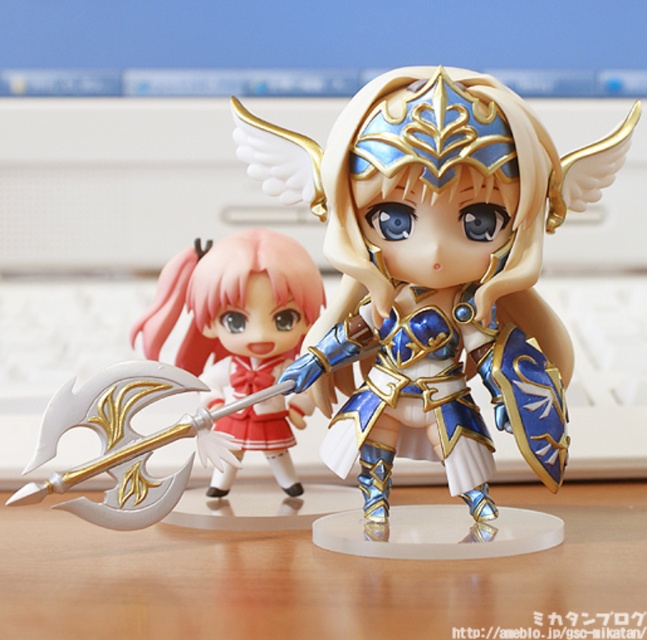
Question: Which point is closer to the camera taking this photo?

Choices:
 (A) (465, 381)
 (B) (393, 605)
 (C) (215, 378)

Answer: (B)

Question: Is blue metallic armor at center further to the viewer compared to matte gold axe at center?

Choices:
 (A) yes
 (B) no

Answer: (B)

Question: Which of these objects is positioned closest to the wooden table at center?

Choices:
 (A) matte gold axe at center
 (B) blue metallic armor at center

Answer: (B)

Question: Does blue metallic armor at center appear on the right side of wooden table at center?

Choices:
 (A) no
 (B) yes

Answer: (B)

Question: Which point is farther to the camera?

Choices:
 (A) (342, 602)
 (B) (302, 266)
 (C) (384, 440)

Answer: (B)

Question: Observing the image, what is the correct spatial positioning of blue metallic armor at center in reference to matte gold axe at center?

Choices:
 (A) below
 (B) above

Answer: (B)